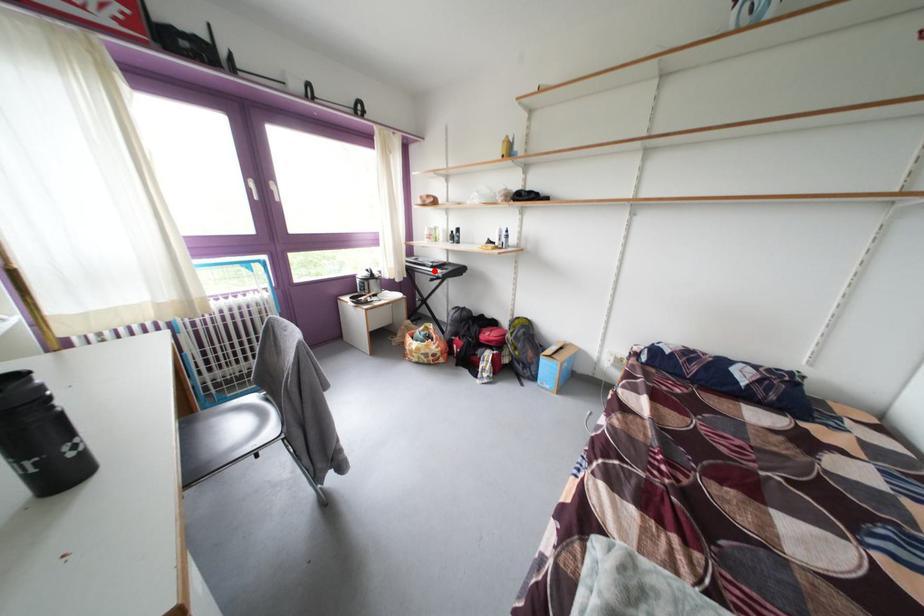
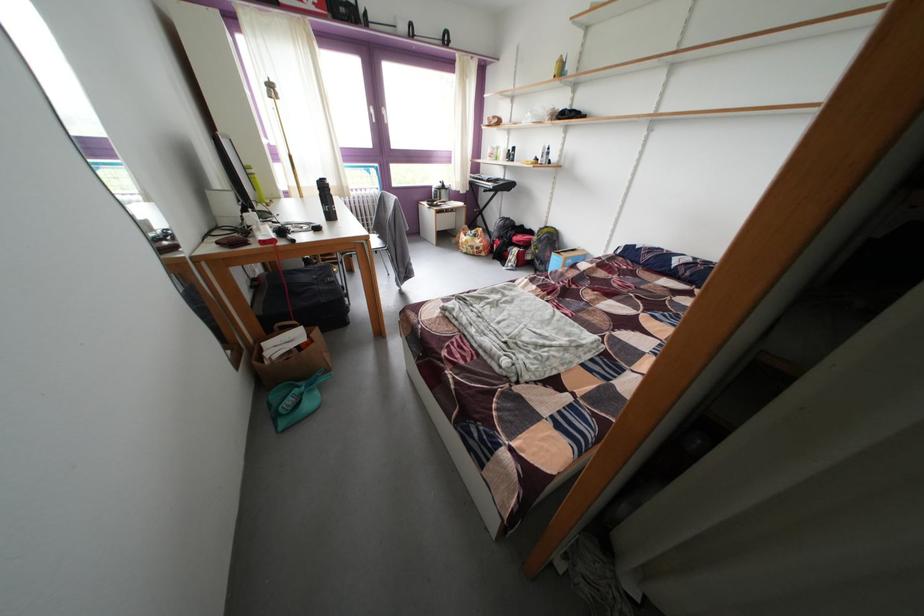
Question: I am providing you with two images of the same scene from different viewpoints. A red point is marked on the first image. At the location where the point appears in image 1, is it still visible in image 2?

Choices:
 (A) Yes
 (B) No

Answer: (A)